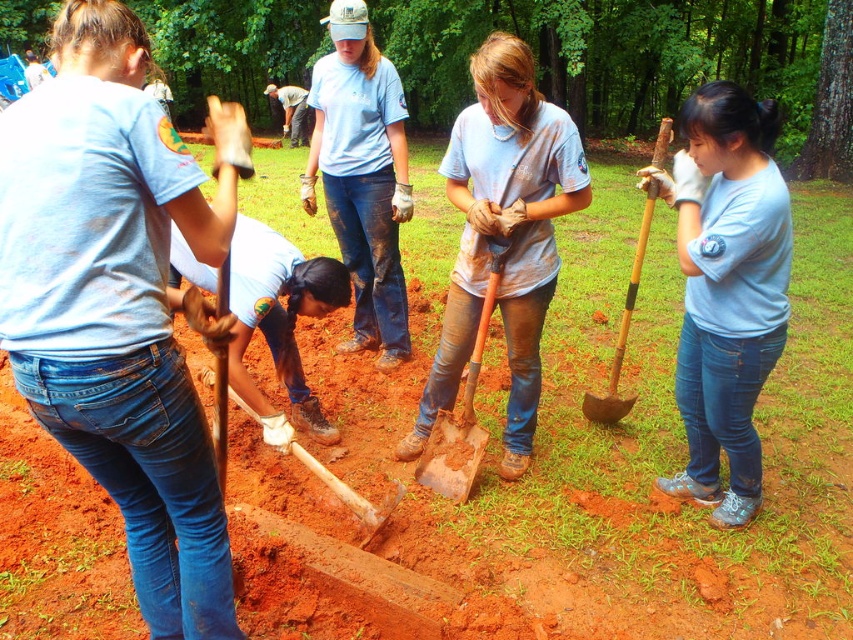
Question: Does matte blue shirt at upper left come in front of light blue t-shirt at center?

Choices:
 (A) no
 (B) yes

Answer: (B)

Question: Does matte blue shirt at upper left appear over brown wooden shovel at right?

Choices:
 (A) no
 (B) yes

Answer: (A)

Question: Is the position of dirty blue jeans at center less distant than that of light blue t-shirt at center?

Choices:
 (A) yes
 (B) no

Answer: (A)

Question: Which point is farther from the camera taking this photo?

Choices:
 (A) (521, 371)
 (B) (759, 381)
 (C) (648, 186)

Answer: (A)

Question: Considering the real-world distances, which object is farthest from the light blue t-shirt at center?

Choices:
 (A) brown wooden shovel at center
 (B) dirty blue jeans at center
 (C) matte blue shirt at upper left
 (D) white matte shovel at center

Answer: (C)

Question: Which object is farther from the camera taking this photo?

Choices:
 (A) white matte shovel at center
 (B) blue jeans at center
 (C) brown wooden shovel at center
 (D) matte blue shirt at upper left

Answer: (C)